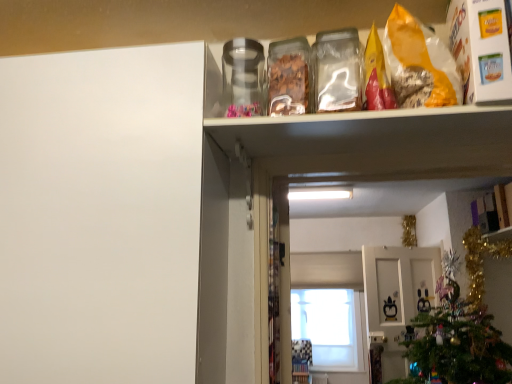
Question: From a real-world perspective, is matte white cabinet at upper right on top of white glossy cabinet doors at center?

Choices:
 (A) no
 (B) yes

Answer: (B)

Question: Does matte white cabinet at upper right have a lesser width compared to white glossy cabinet doors at center?

Choices:
 (A) yes
 (B) no

Answer: (B)

Question: Can you confirm if matte white cabinet at upper right is positioned to the right of white glossy cabinet doors at center?

Choices:
 (A) yes
 (B) no

Answer: (A)

Question: Is the position of matte white cabinet at upper right more distant than that of white glossy cabinet doors at center?

Choices:
 (A) yes
 (B) no

Answer: (B)

Question: Considering the relative sizes of matte white cabinet at upper right and white glossy cabinet doors at center in the image provided, is matte white cabinet at upper right bigger than white glossy cabinet doors at center?

Choices:
 (A) yes
 (B) no

Answer: (B)

Question: From the image's perspective, is transparent glass window at center above or below white matte cabinet door at left?

Choices:
 (A) below
 (B) above

Answer: (A)

Question: Is point (335, 364) positioned closer to the camera than point (162, 183)?

Choices:
 (A) closer
 (B) farther

Answer: (B)

Question: Considering the positions of transparent glass window at center and white matte cabinet door at left in the image, is transparent glass window at center bigger or smaller than white matte cabinet door at left?

Choices:
 (A) small
 (B) big

Answer: (A)

Question: Looking at their shapes, would you say transparent glass window at center is wider or thinner than white matte cabinet door at left?

Choices:
 (A) thin
 (B) wide

Answer: (A)

Question: From the image's perspective, is transparent glass window at center positioned above or below white glossy cabinet doors at center?

Choices:
 (A) above
 (B) below

Answer: (A)

Question: In the image, is transparent glass window at center positioned in front of or behind white glossy cabinet doors at center?

Choices:
 (A) behind
 (B) front

Answer: (B)

Question: Does point (324, 309) appear closer or farther from the camera than point (399, 332)?

Choices:
 (A) closer
 (B) farther

Answer: (B)

Question: From a real-world perspective, is transparent glass window at center physically located above or below white glossy cabinet doors at center?

Choices:
 (A) above
 (B) below

Answer: (A)

Question: From a real-world perspective, relative to matte white cabinet at upper right, is white matte cabinet door at left vertically above or below?

Choices:
 (A) below
 (B) above

Answer: (A)

Question: Considering the positions of white matte cabinet door at left and matte white cabinet at upper right in the image, is white matte cabinet door at left taller or shorter than matte white cabinet at upper right?

Choices:
 (A) tall
 (B) short

Answer: (A)